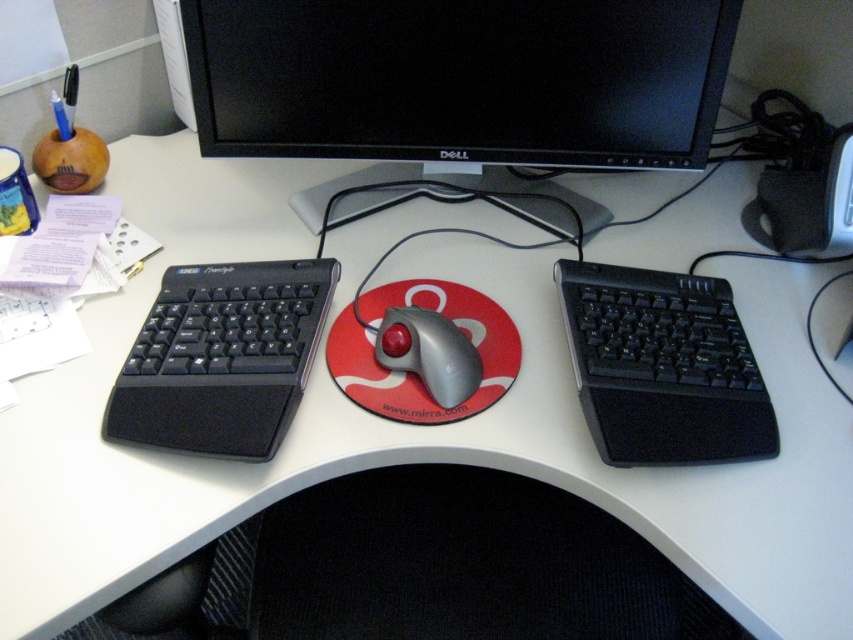
Question: Does black plastic monitor at upper center appear over black textured keyboard at right?

Choices:
 (A) yes
 (B) no

Answer: (A)

Question: Based on their relative distances, which object is farther from the black matte keyboard at left?

Choices:
 (A) black plastic monitor at upper center
 (B) metallic gray trackball at center

Answer: (A)

Question: Among these points, which one is nearest to the camera?

Choices:
 (A) (647, 26)
 (B) (596, 301)
 (C) (207, 348)

Answer: (C)

Question: Which point is farther to the camera?

Choices:
 (A) black plastic monitor at upper center
 (B) black textured keyboard at right
 (C) black matte keyboard at left

Answer: (A)

Question: Is black textured keyboard at right thinner than metallic gray trackball at center?

Choices:
 (A) no
 (B) yes

Answer: (A)

Question: Is black plastic monitor at upper center positioned in front of black matte keyboard at left?

Choices:
 (A) yes
 (B) no

Answer: (B)